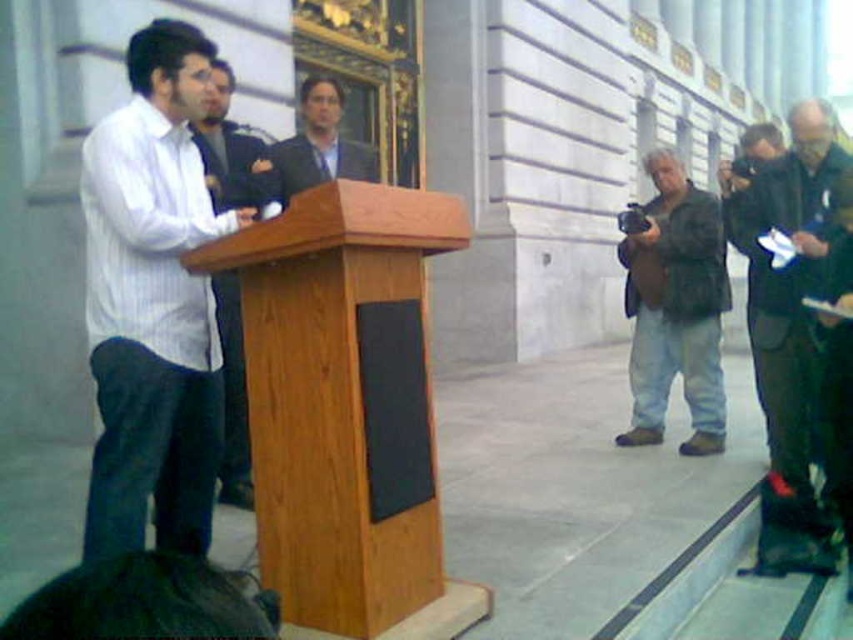
Who is lower down, white striped dress shirt at center or matte black suit at center?

white striped dress shirt at center is lower down.

Which is more to the right, white striped dress shirt at center or matte black suit at center?

matte black suit at center

Identify the location of white striped dress shirt at center. (152, 304).

Locate an element on the screen. The width and height of the screenshot is (853, 640). white striped dress shirt at center is located at coordinates [x=152, y=304].

Is point (286, 593) positioned before point (784, 204)?

Yes, point (286, 593) is in front of point (784, 204).

This screenshot has height=640, width=853. Find the location of `wooden podium at center`. wooden podium at center is located at coordinates (x=347, y=410).

Between dark gray fabric jacket at right and matte black suit at center, which one appears on the right side from the viewer's perspective?

dark gray fabric jacket at right

Does point (795, 566) come in front of point (316, 83)?

Yes, it is in front of point (316, 83).

At what (x,y) coordinates should I click in order to perform the action: click on dark gray fabric jacket at right. Please return your answer as a coordinate pair (x, y). Looking at the image, I should click on (787, 324).